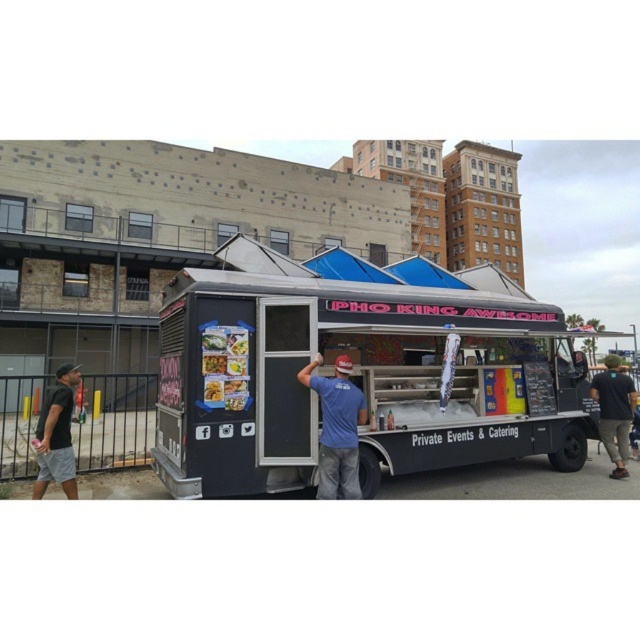
Question: Is black matte food truck at center thinner than blue cotton shirt at center?

Choices:
 (A) yes
 (B) no

Answer: (A)

Question: Can you confirm if black matte food truck at center is positioned to the right of matte plastic food at center?

Choices:
 (A) yes
 (B) no

Answer: (B)

Question: Considering the real-world distances, which object is farthest from the blue cotton shirt at center?

Choices:
 (A) smooth glossy rice noodles at center
 (B) matte plastic food at center
 (C) black matte food truck at center

Answer: (C)

Question: Which point is closer to the camera taking this photo?

Choices:
 (A) (262, 461)
 (B) (340, 454)
 (C) (212, 355)

Answer: (C)

Question: Estimate the real-world distances between objects in this image. Which object is farther from the black cotton shirt at right?

Choices:
 (A) black matte food truck at center
 (B) blue cotton shirt at center
 (C) matte plastic food at center
 (D) black cotton shirt at left

Answer: (D)

Question: Does black matte food truck at center have a larger size compared to black cotton shirt at left?

Choices:
 (A) yes
 (B) no

Answer: (B)